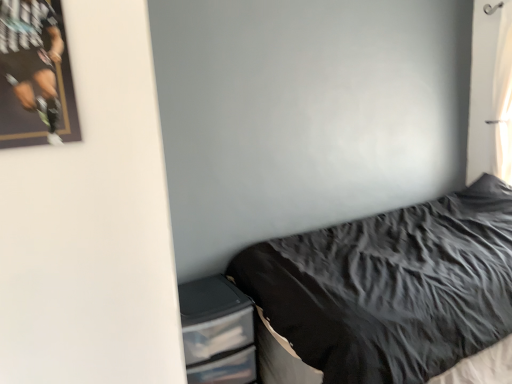
This screenshot has height=384, width=512. What do you see at coordinates (391, 287) in the screenshot?
I see `black textured fabric at lower right` at bounding box center [391, 287].

This screenshot has height=384, width=512. In order to click on white sheer curtain at upper right in this screenshot , I will do `click(503, 99)`.

Where is `clear plastic drawers at lower left`? clear plastic drawers at lower left is located at coordinates (x=217, y=331).

Is matte black poster at upper left not near clear plastic drawers at lower left?

Yes, matte black poster at upper left and clear plastic drawers at lower left are quite far apart.

From a real-world perspective, does matte black poster at upper left sit lower than clear plastic drawers at lower left?

Incorrect, from a real-world perspective, matte black poster at upper left is higher than clear plastic drawers at lower left.

Identify the location of dresser below the matte black poster at upper left (from a real-world perspective). The image size is (512, 384). (217, 331).

Consider the image. Relative to clear plastic drawers at lower left, is matte black poster at upper left in front or behind?

Clearly, matte black poster at upper left is in front of clear plastic drawers at lower left.

Between point (197, 324) and point (342, 321), which one is positioned in front?

Point (342, 321)

Can you confirm if clear plastic drawers at lower left is shorter than black textured fabric at lower right?

Indeed, clear plastic drawers at lower left has a lesser height compared to black textured fabric at lower right.

Does clear plastic drawers at lower left have a larger size compared to black textured fabric at lower right?

Incorrect, clear plastic drawers at lower left is not larger than black textured fabric at lower right.

Is clear plastic drawers at lower left surrounding black textured fabric at lower right?

No, clear plastic drawers at lower left does not contain black textured fabric at lower right.

Is the surface of black textured fabric at lower right in direct contact with clear plastic drawers at lower left?

No, black textured fabric at lower right is not with clear plastic drawers at lower left.

How many degrees apart are the facing directions of black textured fabric at lower right and clear plastic drawers at lower left?

The facing directions of black textured fabric at lower right and clear plastic drawers at lower left are 87.1 degrees apart.

Which is more to the right, black textured fabric at lower right or clear plastic drawers at lower left?

Positioned to the right is black textured fabric at lower right.

Considering the relative sizes of black textured fabric at lower right and clear plastic drawers at lower left in the image provided, is black textured fabric at lower right wider than clear plastic drawers at lower left?

Correct, the width of black textured fabric at lower right exceeds that of clear plastic drawers at lower left.

Which object is positioned more to the right, clear plastic drawers at lower left or matte black poster at upper left?

From the viewer's perspective, clear plastic drawers at lower left appears more on the right side.

Measure the distance from clear plastic drawers at lower left to matte black poster at upper left.

The distance of clear plastic drawers at lower left from matte black poster at upper left is 3.96 feet.

Does clear plastic drawers at lower left have a lesser width compared to matte black poster at upper left?

In fact, clear plastic drawers at lower left might be wider than matte black poster at upper left.

From the image's perspective, which object appears higher, clear plastic drawers at lower left or matte black poster at upper left?

From the image's view, matte black poster at upper left is above.

Could you tell me if matte black poster at upper left is turned towards white sheer curtain at upper right?

No, matte black poster at upper left is not oriented towards white sheer curtain at upper right.

This screenshot has height=384, width=512. I want to click on person that is on the left side of white sheer curtain at upper right, so click(31, 57).

From a real-world perspective, is matte black poster at upper left over white sheer curtain at upper right?

Correct, in the physical world, matte black poster at upper left is higher than white sheer curtain at upper right.

How different are the orientations of matte black poster at upper left and white sheer curtain at upper right in degrees?

They differ by 89.2 degrees in their facing directions.

Is white sheer curtain at upper right wider or thinner than matte black poster at upper left?

Considering their sizes, white sheer curtain at upper right looks broader than matte black poster at upper left.

You are a GUI agent. You are given a task and a screenshot of the screen. Output one action in this format:
    pyautogui.click(x=<x>, y=<y>)
    Task: Click on the person located below the white sheer curtain at upper right (from the image's perspective)
    The width and height of the screenshot is (512, 384).
    Given the screenshot: What is the action you would take?
    pyautogui.click(x=31, y=57)

In the scene shown: From the image's perspective, is white sheer curtain at upper right positioned above or below matte black poster at upper left?

white sheer curtain at upper right is above matte black poster at upper left.

Does white sheer curtain at upper right touch matte black poster at upper left?

white sheer curtain at upper right and matte black poster at upper left are not in contact.

How many degrees apart are the facing directions of white sheer curtain at upper right and black textured fabric at lower right?

There is a 0.0386-degree angle between the facing directions of white sheer curtain at upper right and black textured fabric at lower right.

From the image's perspective, is white sheer curtain at upper right over black textured fabric at lower right?

Yes, from the image's perspective, white sheer curtain at upper right is above black textured fabric at lower right.

Considering the sizes of objects white sheer curtain at upper right and black textured fabric at lower right in the image provided, who is thinner, white sheer curtain at upper right or black textured fabric at lower right?

Thinner between the two is white sheer curtain at upper right.

Between point (495, 127) and point (430, 243), which one is positioned behind?

The point (495, 127) is farther.

Find the location of `dresser behind the matte black poster at upper left`. dresser behind the matte black poster at upper left is located at coordinates (217, 331).

The image size is (512, 384). In the image, there is a clear plastic drawers at lower left. What are the coordinates of `bed above it (from the image's perspective)` in the screenshot? It's located at click(x=391, y=287).

Based on their spatial positions, is clear plastic drawers at lower left or white sheer curtain at upper right closer to black textured fabric at lower right?

The object closer to black textured fabric at lower right is clear plastic drawers at lower left.

Estimate the real-world distances between objects in this image. Which object is closer to matte black poster at upper left, clear plastic drawers at lower left or white sheer curtain at upper right?

The object closer to matte black poster at upper left is clear plastic drawers at lower left.

Considering their positions, is black textured fabric at lower right positioned closer to white sheer curtain at upper right than matte black poster at upper left?

black textured fabric at lower right lies closer to white sheer curtain at upper right than the other object.

Which object lies nearer to the anchor point white sheer curtain at upper right, clear plastic drawers at lower left or matte black poster at upper left?

Among the two, clear plastic drawers at lower left is located nearer to white sheer curtain at upper right.

Considering their positions, is clear plastic drawers at lower left positioned closer to white sheer curtain at upper right than black textured fabric at lower right?

black textured fabric at lower right lies closer to white sheer curtain at upper right than the other object.

Looking at the image, which one is located further to white sheer curtain at upper right, matte black poster at upper left or black textured fabric at lower right?

matte black poster at upper left is positioned further to the anchor white sheer curtain at upper right.

Considering their positions, is white sheer curtain at upper right positioned closer to matte black poster at upper left than clear plastic drawers at lower left?

clear plastic drawers at lower left.

Based on their spatial positions, is matte black poster at upper left or clear plastic drawers at lower left further from black textured fabric at lower right?

Based on the image, matte black poster at upper left appears to be further to black textured fabric at lower right.

The width and height of the screenshot is (512, 384). I want to click on dresser between matte black poster at upper left and white sheer curtain at upper right, so [217, 331].

At what (x,y) coordinates should I click in order to perform the action: click on bed between clear plastic drawers at lower left and white sheer curtain at upper right in the horizontal direction. Please return your answer as a coordinate pair (x, y). Looking at the image, I should click on (391, 287).

The image size is (512, 384). I want to click on bed located between matte black poster at upper left and white sheer curtain at upper right in the left-right direction, so pyautogui.click(x=391, y=287).

This screenshot has width=512, height=384. What are the coordinates of `dresser between matte black poster at upper left and black textured fabric at lower right in the horizontal direction` in the screenshot? It's located at (217, 331).